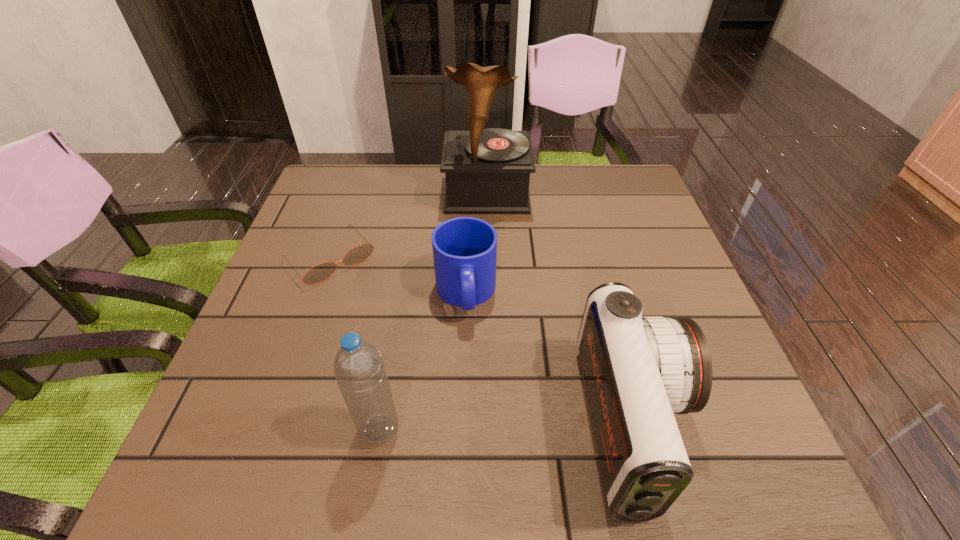
Locate an element on the screen. The image size is (960, 540). free space on the desktop that is between the water bottle and the rightmost object and is positioned on the face of the shortest object is located at coordinates (482, 428).

Locate an element on the screen. This screenshot has width=960, height=540. free spot on the desktop that is between the second object from left to right and the rightmost object and is positioned at the horn opening of the tallest object is located at coordinates (490, 428).

You are a GUI agent. You are given a task and a screenshot of the screen. Output one action in this format:
    pyautogui.click(x=<x>, y=<y>)
    Task: Click on the free spot on the desktop that is between the second tallest object and the rightmost object and is positioned on the side with the handle of the mug
    This screenshot has width=960, height=540.
    Given the screenshot: What is the action you would take?
    pyautogui.click(x=476, y=428)